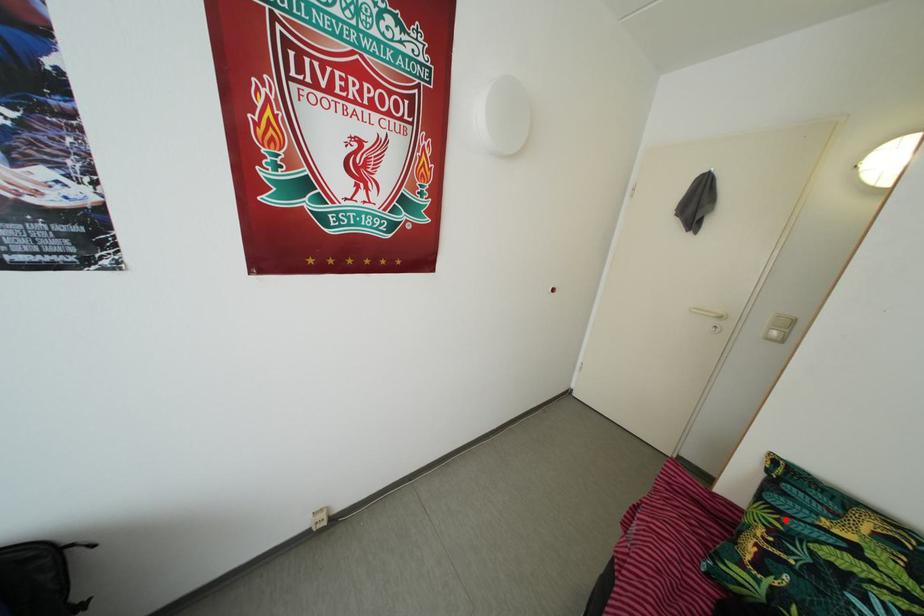
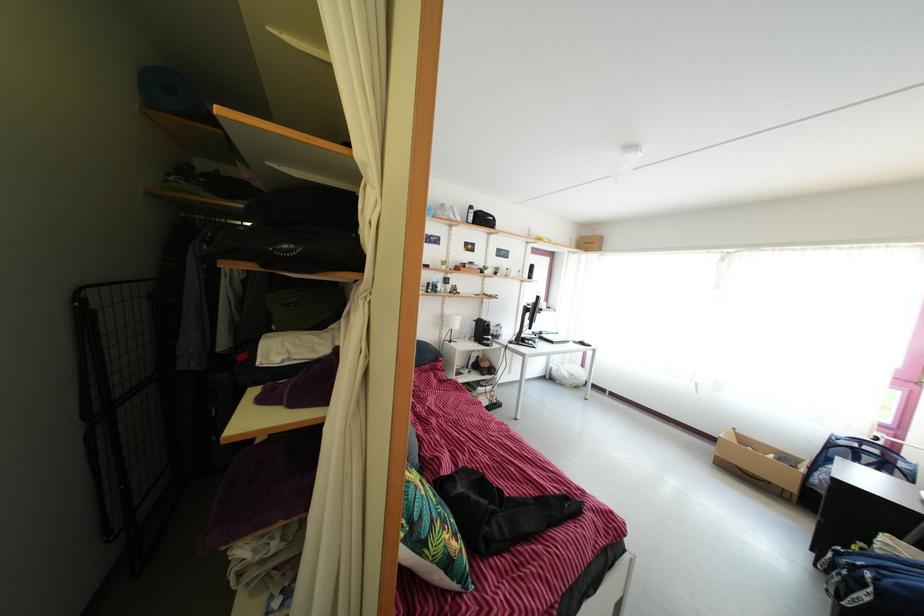
Locate, in the second image, the point that corresponds to the highlighted location in the first image.

(439, 531)